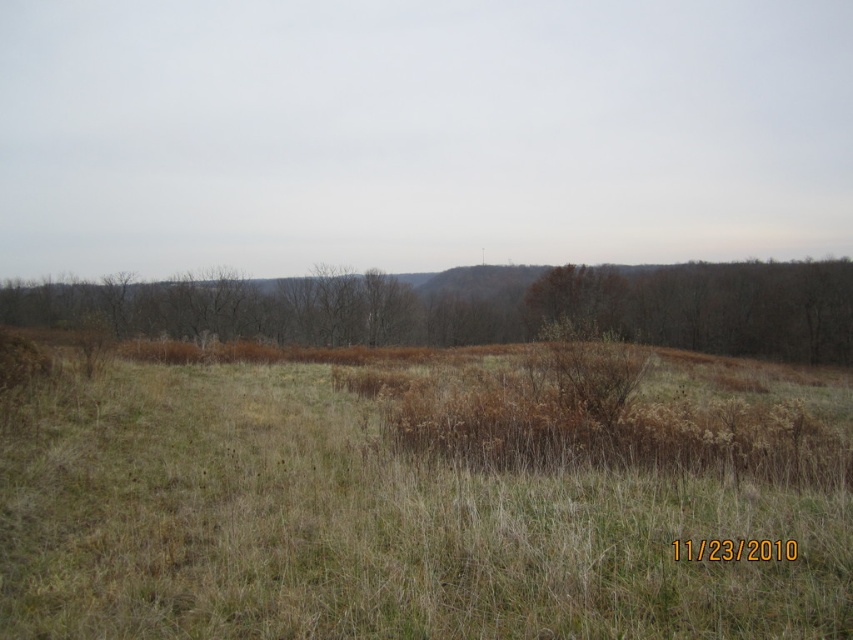
Who is shorter, dry grass at center or brown textured shrub at center?

With less height is dry grass at center.

Is dry grass at center below brown textured shrub at center?

Correct, dry grass at center is located below brown textured shrub at center.

Locate an element on the screen. This screenshot has width=853, height=640. dry grass at center is located at coordinates (367, 525).